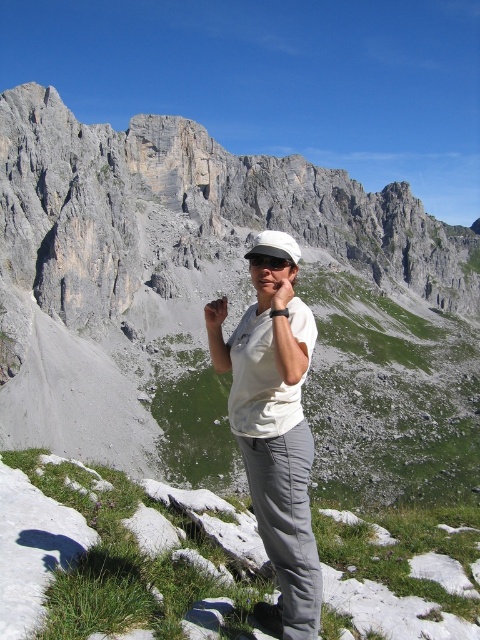
Is the position of white cotton shirt at center less distant than that of brown leather hand at center?

Yes, white cotton shirt at center is closer to the viewer.

Can you confirm if white cotton shirt at center is bigger than brown leather hand at center?

Correct, white cotton shirt at center is larger in size than brown leather hand at center.

Locate an element on the screen. white cotton shirt at center is located at coordinates (276, 444).

Find the location of a particular element. The width and height of the screenshot is (480, 640). white cotton shirt at center is located at coordinates (276, 444).

Consider the image. Does gray rock mountain at center have a greater width compared to matte white hand at center?

Yes.

Does gray rock mountain at center have a lesser width compared to matte white hand at center?

No, gray rock mountain at center is not thinner than matte white hand at center.

Between point (210, 161) and point (280, 294), which one is positioned in front?

Point (280, 294) is more forward.

Identify the location of gray rock mountain at center. Image resolution: width=480 pixels, height=640 pixels. (228, 305).

Who is more distant from viewer, (55, 417) or (207, 323)?

The point (55, 417) is more distant.

Between point (336, 209) and point (226, 298), which one is positioned behind?

The point (336, 209) is behind.

Where is `gray rock mountain at center`? This screenshot has width=480, height=640. gray rock mountain at center is located at coordinates (228, 305).